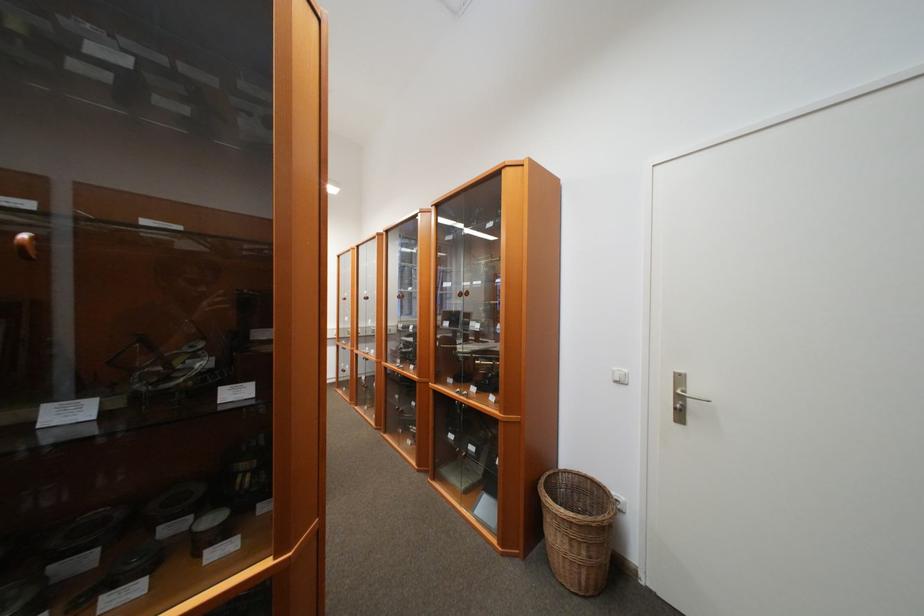
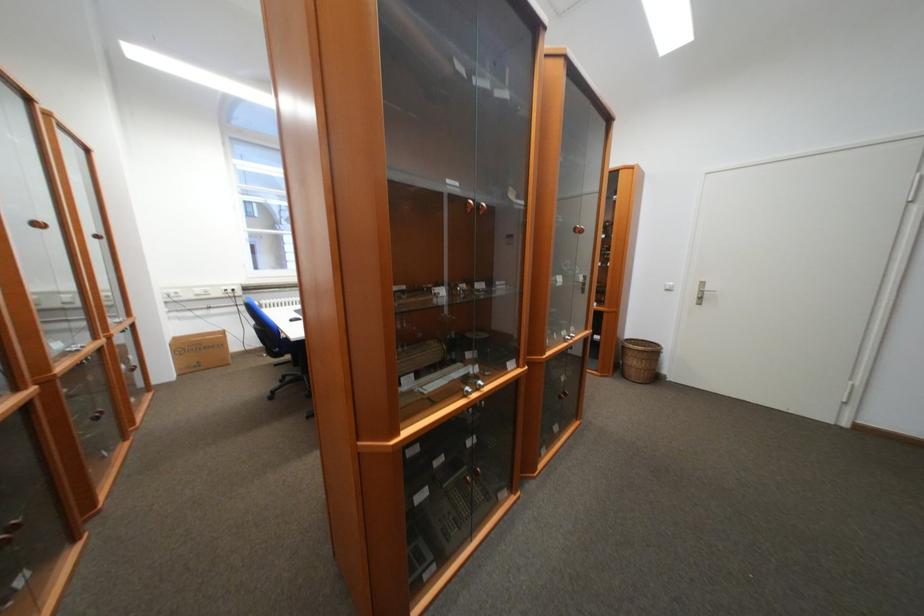
The images are taken continuously from a first-person perspective. In which direction are you moving?

The cameraman walked toward left, backward.